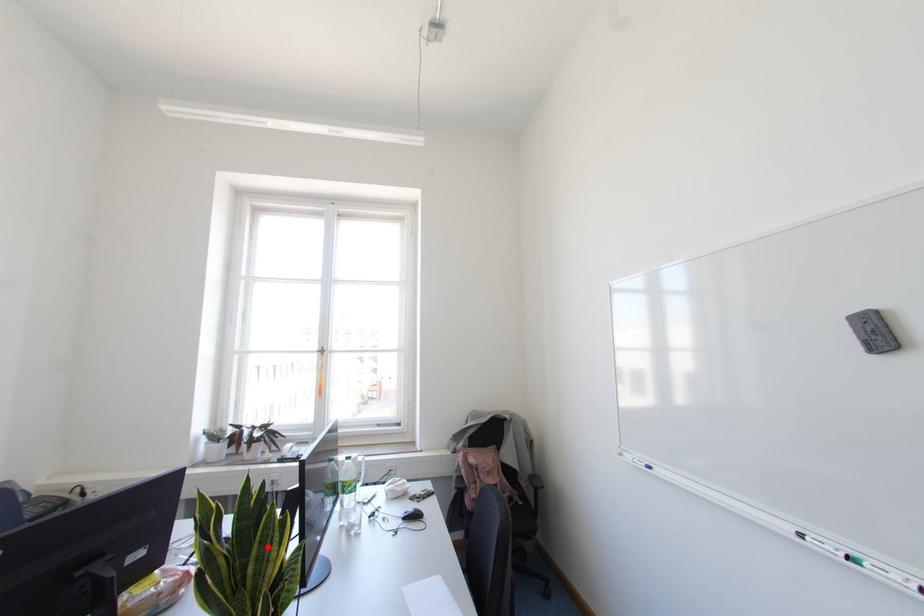
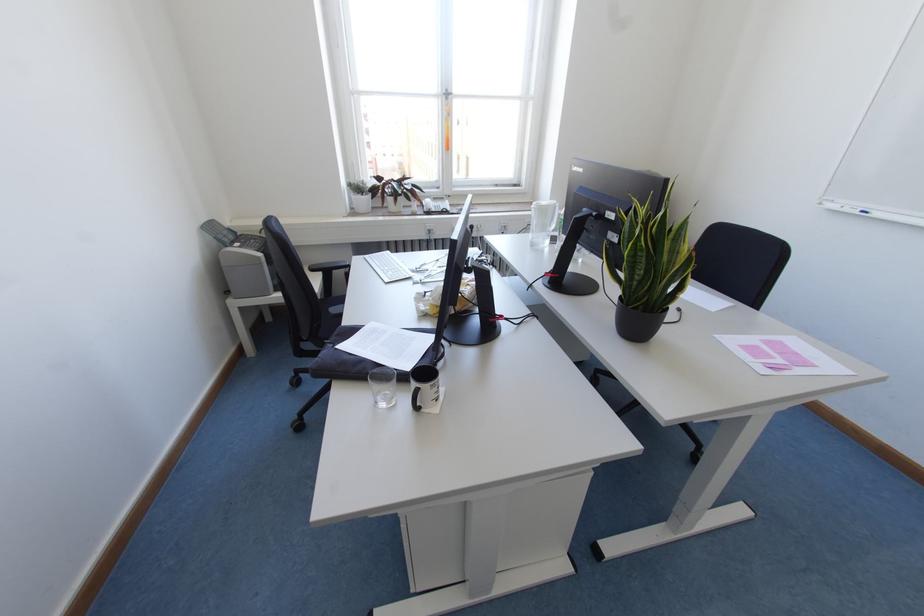
Question: I am providing you with two images of the same scene from different viewpoints. A red point is marked on the first image. At the location where the point appears in image 1, is it still visible in image 2?

Choices:
 (A) Yes
 (B) No

Answer: (A)